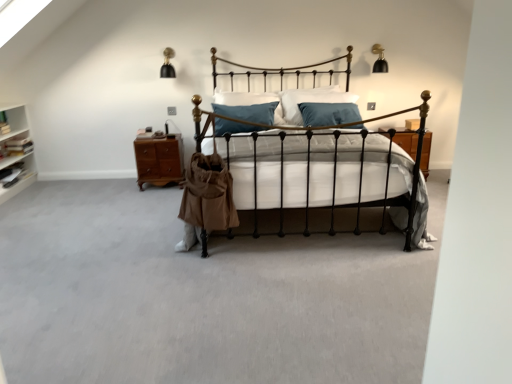
Question: Is blue velvet pillow at center taller or shorter than brown wood nightstand at left?

Choices:
 (A) short
 (B) tall

Answer: (A)

Question: Considering the positions of blue velvet pillow at center and brown wood nightstand at left in the image, is blue velvet pillow at center bigger or smaller than brown wood nightstand at left?

Choices:
 (A) small
 (B) big

Answer: (B)

Question: Which is farther from the blue velvet pillow at center?

Choices:
 (A) black wrought iron bed at center
 (B) brown wood nightstand at left

Answer: (A)

Question: Which object is the farthest from the blue velvet pillow at center?

Choices:
 (A) brown wood nightstand at left
 (B) black wrought iron bed at center

Answer: (B)